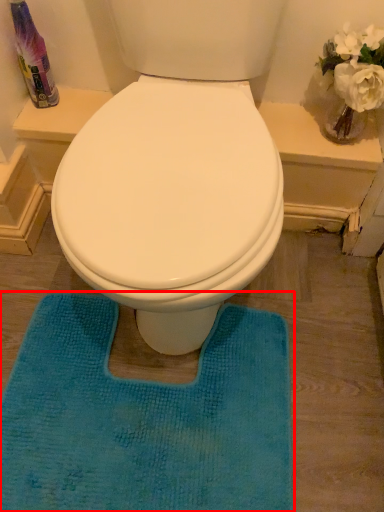
Question: From the image, what is the correct spatial relationship of bath mat (annotated by the red box) in relation to cleaning product?

Choices:
 (A) left
 (B) right

Answer: (B)